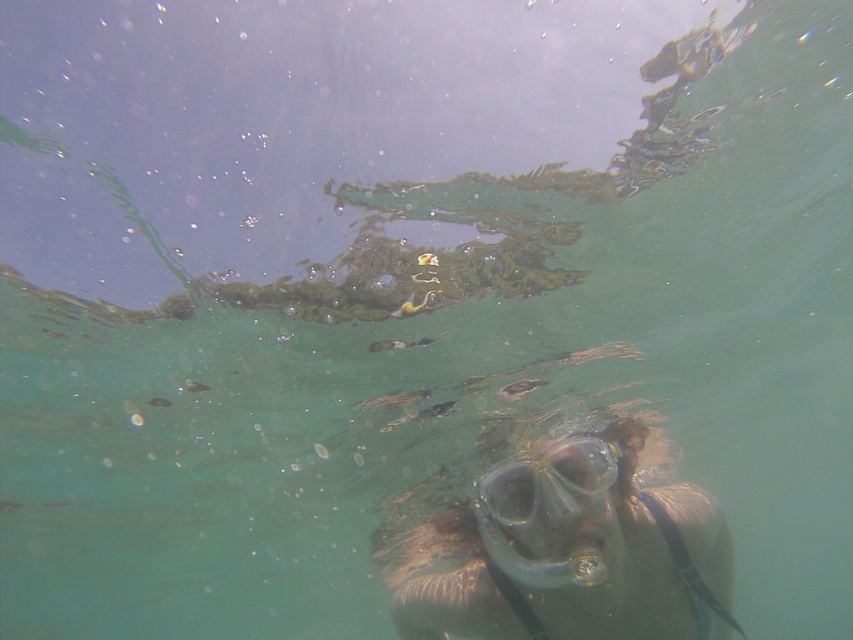
Based on the photo, you are a diver preparing to take a photo of the clear plastic mask at center from a distance of 10 feet. Based on the scene description, will the mask be in focus if your camera is set to focus at 10 feet?

The clear plastic mask at center is 9.79 feet away from the camera. Since the camera is set to focus at 10 feet, the mask is slightly closer than the focus distance. The slight difference of 0.21 feet might result in a minor blur, but it could still be acceptably sharp depending on the camera lens and aperture used.

You are a marine biologist observing an underwater scene. You notice a clear plastic mask at center and a transparent plastic goggles at center. How far apart are these two items from each other?

The distance between the clear plastic mask at center and the transparent plastic goggles at center is 1.87 meters.